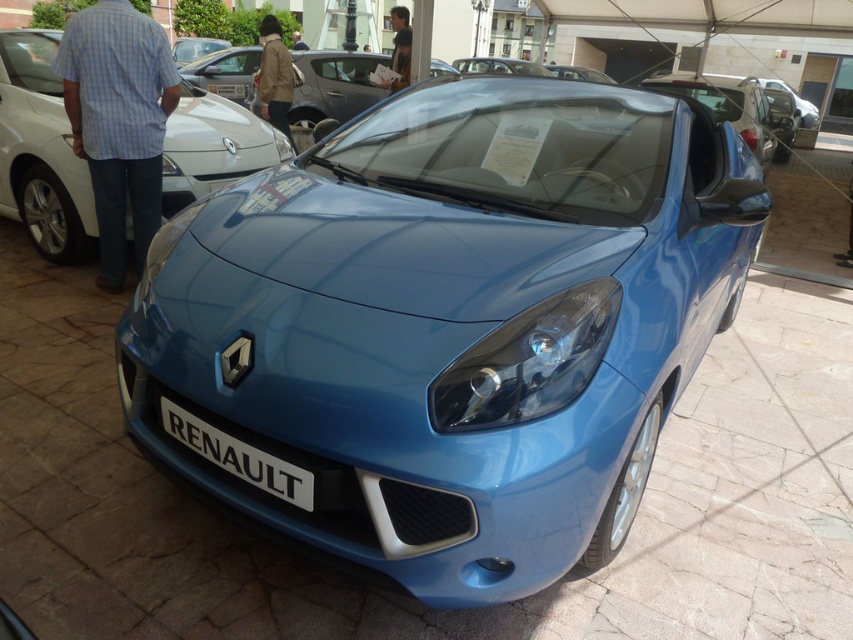
Question: Among these points, which one is nearest to the camera?

Choices:
 (A) (399, 68)
 (B) (119, 253)

Answer: (B)

Question: Which object is the closest to the light brown leather jacket at upper center?

Choices:
 (A) white plastic license plate at center
 (B) metallic blue car at center
 (C) blue cotton shirt at left
 (D) glossy blue sedan at center

Answer: (A)

Question: Is glossy blue car at center smaller than white matte license plate at center?

Choices:
 (A) yes
 (B) no

Answer: (B)

Question: Can you confirm if glossy blue car at center is positioned below light brown leather jacket at upper center?

Choices:
 (A) yes
 (B) no

Answer: (A)

Question: Can you confirm if metallic blue car at center is thinner than white matte license plate at center?

Choices:
 (A) no
 (B) yes

Answer: (A)

Question: Based on their relative distances, which object is farther from the glossy blue sedan at center?

Choices:
 (A) glossy blue car at center
 (B) white plastic license plate at center
 (C) blue cotton shirt at left
 (D) metallic blue car at center

Answer: (B)